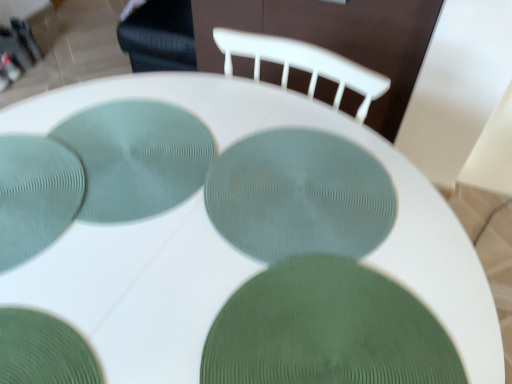
Identify the location of unoccupied space behind green textured plate at center, the 5th glass plate positioned from the left. (302, 196).